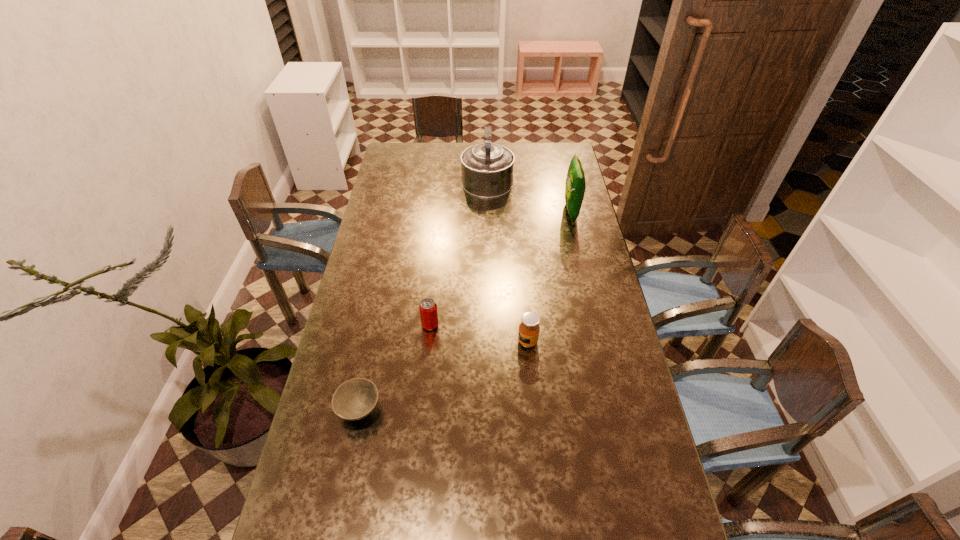
You are a GUI agent. You are given a task and a screenshot of the screen. Output one action in this format:
    pyautogui.click(x=<x>, y=<y>)
    Task: Click on the blank area located with the spout at the front of the kettle
    This screenshot has height=540, width=960.
    Given the screenshot: What is the action you would take?
    pyautogui.click(x=487, y=143)

Identify the location of free location located on the front-facing side of the fourth nearest object. This screenshot has height=540, width=960. (528, 212).

Identify the location of vacant space positioned 0.250m on the front-facing side of the fourth nearest object. This screenshot has height=540, width=960. (505, 212).

Where is `free region located 0.390m on the front-facing side of the fourth nearest object`? This screenshot has height=540, width=960. free region located 0.390m on the front-facing side of the fourth nearest object is located at coordinates (472, 212).

Locate an element on the screen. Image resolution: width=960 pixels, height=540 pixels. vacant area situated 0.260m on the front-facing side of the honey is located at coordinates (437, 342).

In order to click on vacant region located on the front-facing side of the honey in this screenshot , I will do `click(440, 342)`.

What are the coordinates of `blank space located on the front-facing side of the honey` in the screenshot? It's located at (502, 342).

Identify the location of vacant space positioned 0.280m on the front of the second object from left to right. (421, 411).

Identify the location of vacant region located 0.170m on the right of the bowl. (442, 410).

The image size is (960, 540). In order to click on object positioned at the far edge in this screenshot , I will do `click(487, 169)`.